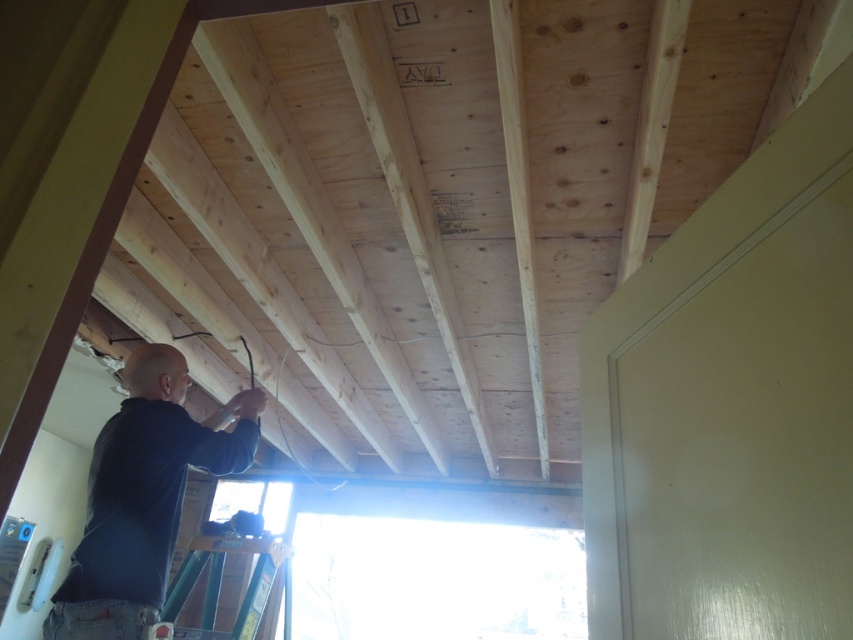
Is dark blue shirt at lower left taller than green metallic ladder at lower left?

Indeed, dark blue shirt at lower left has a greater height compared to green metallic ladder at lower left.

Is dark blue shirt at lower left smaller than green metallic ladder at lower left?

Actually, dark blue shirt at lower left might be larger than green metallic ladder at lower left.

Is point (171, 531) farther from camera compared to point (256, 570)?

That is False.

At what (x,y) coordinates should I click in order to perform the action: click on dark blue shirt at lower left. Please return your answer as a coordinate pair (x, y). The image size is (853, 640). Looking at the image, I should click on (144, 496).